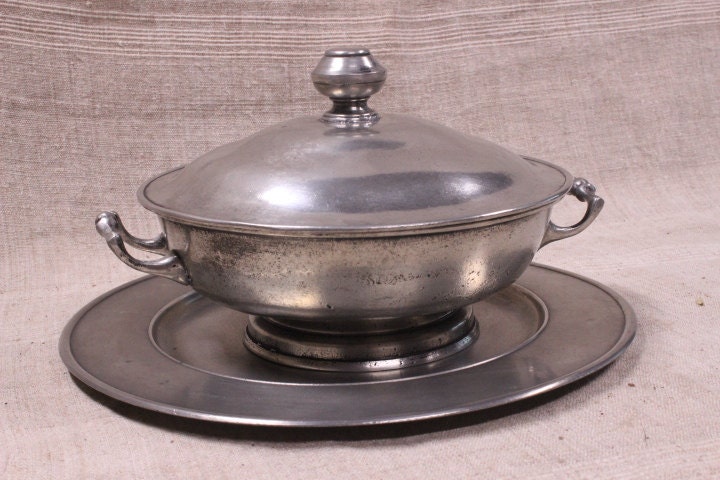
Where is `tureen`? tureen is located at coordinates (391, 267).